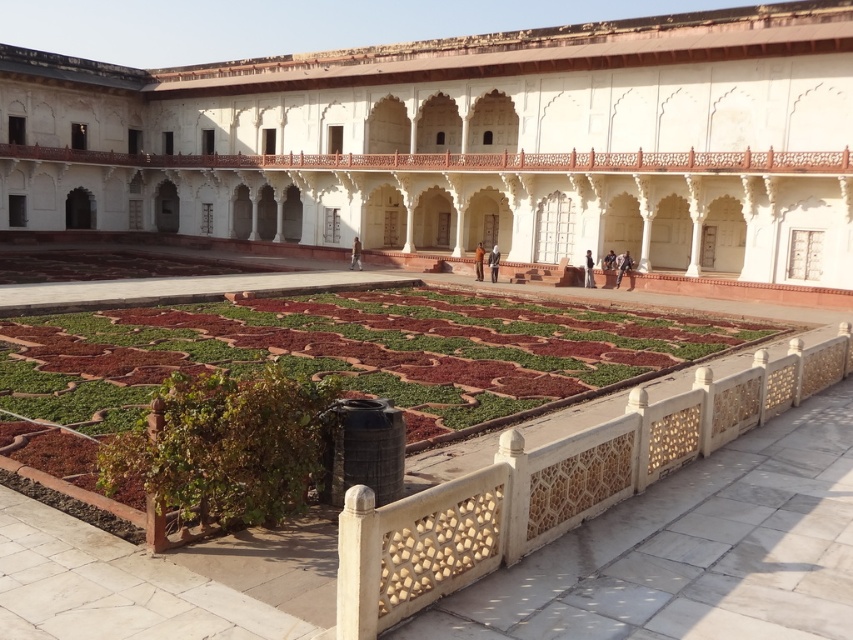
Question: Is dark blue fabric at center further to camera compared to orange fabric at center?

Choices:
 (A) yes
 (B) no

Answer: (B)

Question: Observing the image, what is the correct spatial positioning of white stone palace at center in reference to dark blue jeans at center?

Choices:
 (A) above
 (B) below

Answer: (A)

Question: Which of the following is the farthest from the observer?

Choices:
 (A) green textured garden at center
 (B) dark blue jeans at center

Answer: (B)

Question: Estimate the real-world distances between objects in this image. Which object is farther from the green textured garden at center?

Choices:
 (A) green leafy plant at center
 (B) dark blue uniform at center

Answer: (B)

Question: Based on their relative distances, which object is farther from the green leafy plant at center?

Choices:
 (A) light brown fabric at center
 (B) orange fabric at center
 (C) dark blue jeans at center

Answer: (C)

Question: Is the position of orange fabric at center less distant than that of dark blue jeans at center?

Choices:
 (A) no
 (B) yes

Answer: (A)